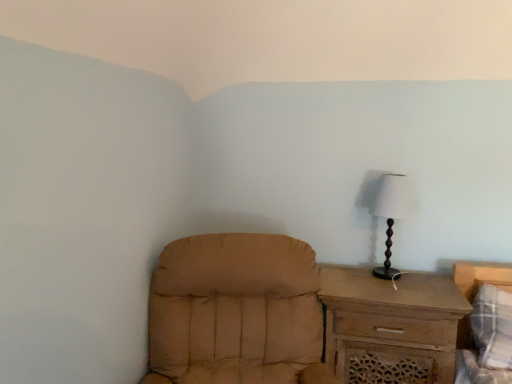
Where is `empty space that is ontop of brown wooden chest of drawers at right`? empty space that is ontop of brown wooden chest of drawers at right is located at coordinates (369, 276).